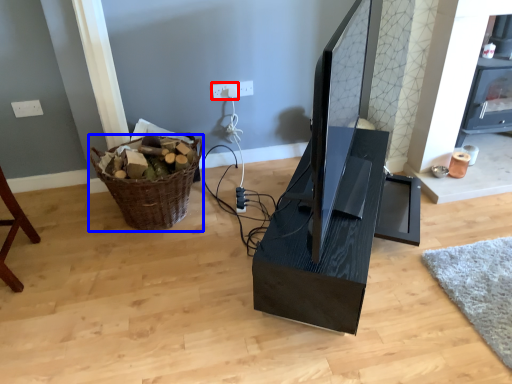
Question: Among these objects, which one is farthest to the camera, electric outlet (highlighted by a red box) or basket (highlighted by a blue box)?

Choices:
 (A) electric outlet
 (B) basket

Answer: (A)